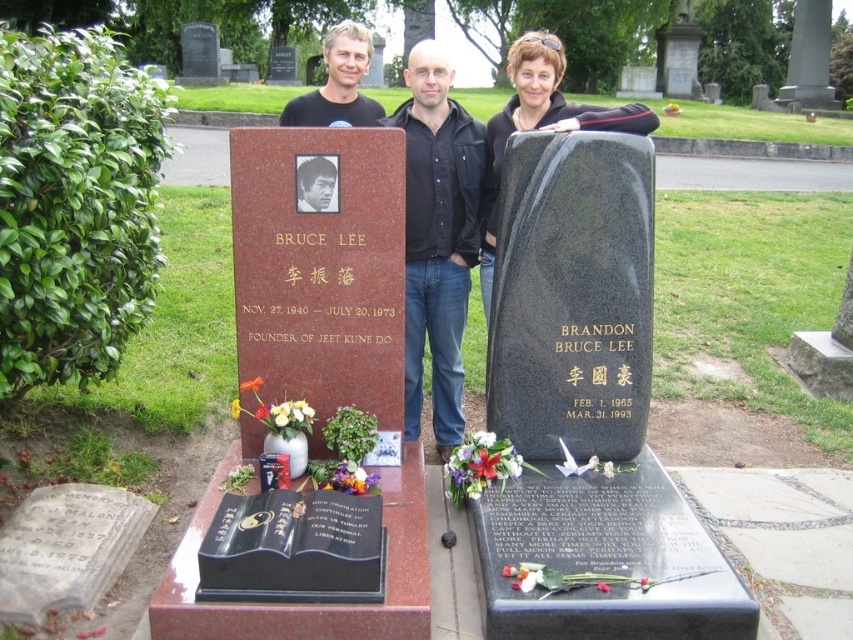
You are a tour guide leading a group to the cemetery. You notice the matte black granite statue at center and the matte black jacket at center. Which one is taller?

The matte black jacket at center is taller than the matte black granite statue at center.

You are a photographer trying to capture a clear photo of both the matte black granite statue at center and the smooth black hair at center. However, the statue is blocking your view of the hair. Can you move to the left or right to get both in frame without moving the subjects?

The smooth black hair at center is behind the matte black granite statue at center, so moving to the left or right might allow you to see around the statue and capture both in the frame.

You are standing in a cemetery and want to place a flower at the base of the matte black granite statue at center. If you are currently 3.47 meters away from it, can you reach the statue without moving closer?

The matte black granite statue at center is 3.47 meters away from you. Since you need to place a flower at its base, you would need to move closer as 3.47 meters is the current distance and you can not reach that far without moving.